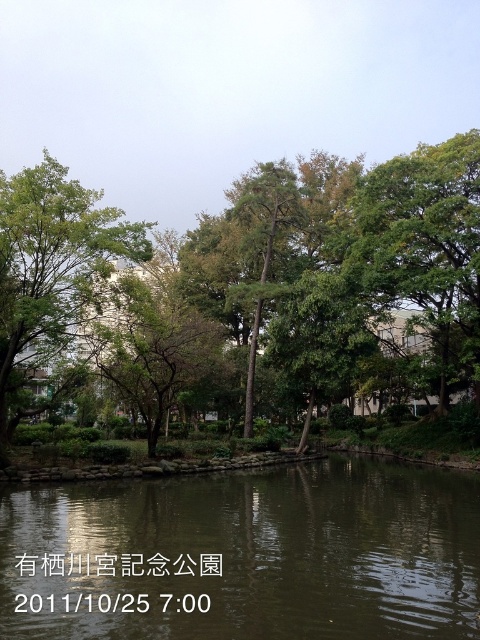
Which of these two, green reflective water at center or green leafy tree at right, stands shorter?

Standing shorter between the two is green reflective water at center.

Measure the distance between point (12, 509) and camera.

49.08 feet

Where is `green reflective water at center`? green reflective water at center is located at coordinates 245,556.

Is green leafy tree at center positioned behind green leafy tree at left?

Yes.

Can you confirm if green leafy tree at center is positioned above green leafy tree at left?

Indeed, green leafy tree at center is positioned over green leafy tree at left.

Is point (338, 236) positioned in front of point (71, 307)?

No, (338, 236) is further to viewer.

I want to click on green leafy tree at center, so click(x=271, y=296).

Does green reflective water at center appear on the left side of green leafy tree at left?

Incorrect, green reflective water at center is not on the left side of green leafy tree at left.

Which of these two, green reflective water at center or green leafy tree at left, stands taller?

Standing taller between the two is green leafy tree at left.

Where is `green reflective water at center`? The image size is (480, 640). green reflective water at center is located at coordinates (245, 556).